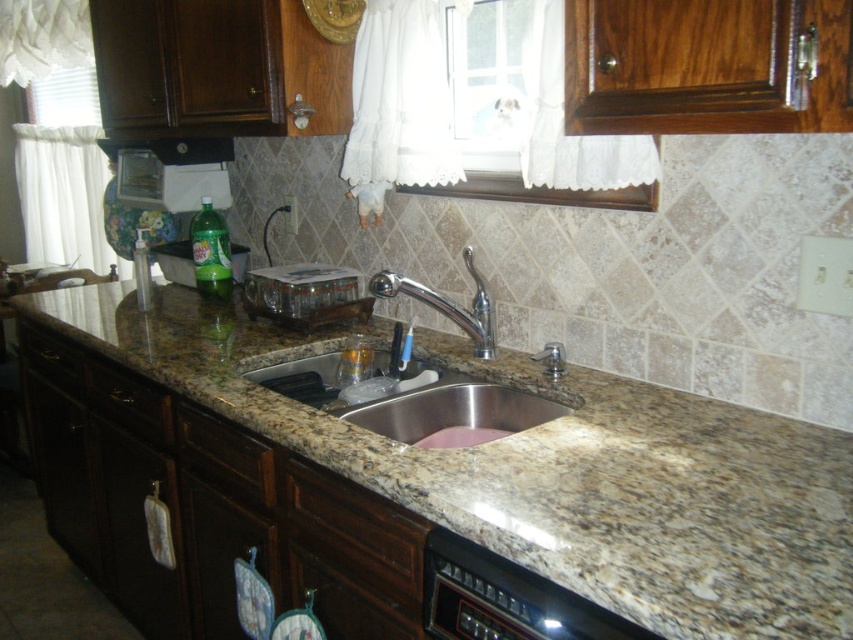
This screenshot has width=853, height=640. What do you see at coordinates (418, 484) in the screenshot?
I see `granite at center` at bounding box center [418, 484].

Is granite at center smaller than polished chrome faucet at center?

Incorrect, granite at center is not smaller in size than polished chrome faucet at center.

Is point (198, 598) positioned in front of point (486, 321)?

No, (198, 598) is further to viewer.

I want to click on granite at center, so (x=418, y=484).

Can you confirm if black plastic dishwasher at lower center is taller than black matte exhaust hood at upper center?

Yes.

Looking at this image, between black plastic dishwasher at lower center and black matte exhaust hood at upper center, which one is positioned higher?

Positioned higher is black matte exhaust hood at upper center.

Is point (433, 608) closer to viewer compared to point (151, 138)?

That is True.

The width and height of the screenshot is (853, 640). In order to click on black plastic dishwasher at lower center in this screenshot , I will do `click(503, 598)`.

Is stainless steel sink at center thinner than green plastic bottle at center?

No.

Where is `stainless steel sink at center`? The image size is (853, 640). stainless steel sink at center is located at coordinates (453, 410).

Who is more distant from viewer, (x=459, y=392) or (x=202, y=269)?

Point (x=202, y=269)

What are the coordinates of `stainless steel sink at center` in the screenshot? It's located at click(453, 410).